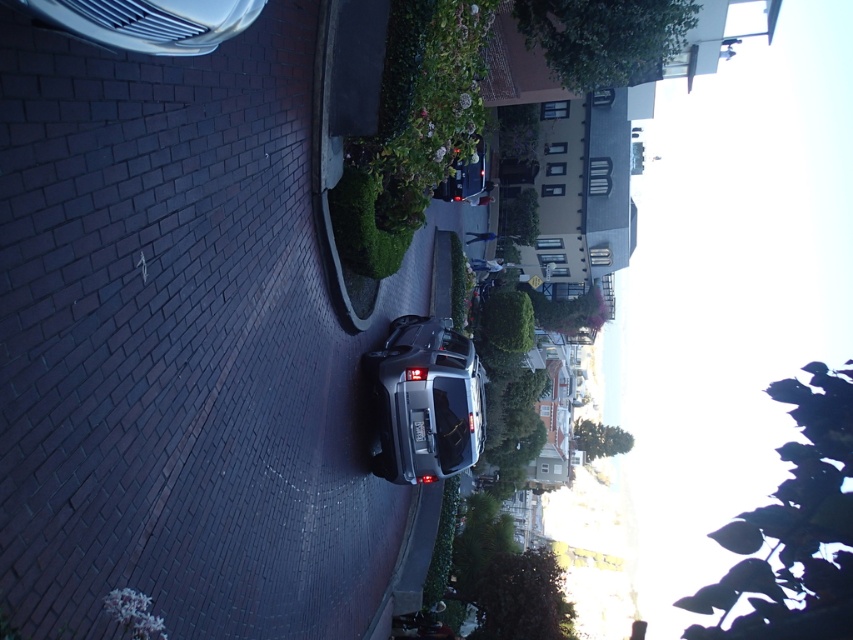
You are a pedestrian standing at the intersection and want to cross the street. There is a satin black suv at center and a silver metallic car at upper left. Which vehicle is closer to you?

The satin black suv at center is closer to you because it is only 16.84 meters away from the silver metallic car at upper left, and since you are at the intersection, the distance between the two vehicles places the satin black suv at center nearer to your position.

You are standing at the point marked by the coordinates point (x=425, y=401) in the image. Which direction should you walk to reach the satin black suv at center?

The point (x=425, y=401) indicates the satin black suv at center, so you are already at the satin black suv at center.

You are a delivery person trying to park your van between the satin black suv at center and the silver metallic car at upper left. Can you estimate if there is enough space between them for your van which is 2.5 meters wide?

The satin black suv at center might be wider than silver metallic car at upper left, so the space between them may not be sufficient for a van that is 2.5 meters wide. It is recommended to look for another parking spot.